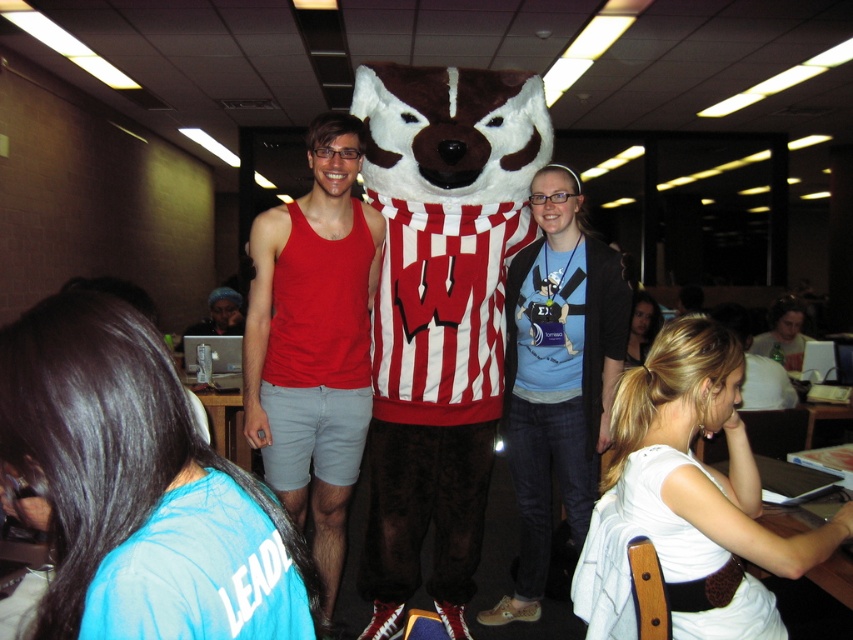
Question: Which of these objects is positioned farthest from the blue cotton t-shirt at center?

Choices:
 (A) matte red tank top at center
 (B) blue fabric shirt at lower left
 (C) white fabric shirt at lower right
 (D) blonde hair at lower right

Answer: (D)

Question: Which of the following is the closest to the observer?

Choices:
 (A) (520, 538)
 (B) (747, 593)

Answer: (B)

Question: Estimate the real-world distances between objects in this image. Which object is closer to the white fabric shirt at lower right?

Choices:
 (A) blue cotton t-shirt at center
 (B) matte red tank top at center

Answer: (A)

Question: Does blonde hair at lower right appear on the left side of silver metallic computer at center?

Choices:
 (A) no
 (B) yes

Answer: (A)

Question: Does white fabric shirt at lower right have a smaller size compared to matte red tank top at center?

Choices:
 (A) yes
 (B) no

Answer: (A)

Question: Does white fabric shirt at lower right appear on the right side of blue cotton t-shirt at center?

Choices:
 (A) no
 (B) yes

Answer: (B)